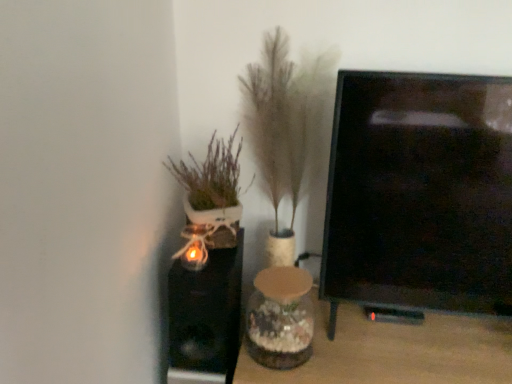
At what (x,y) coordinates should I click in order to perform the action: click on vacant space to the right of translucent glass vase at center. Please return your answer as a coordinate pair (x, y). Image resolution: width=512 pixels, height=384 pixels. Looking at the image, I should click on (344, 339).